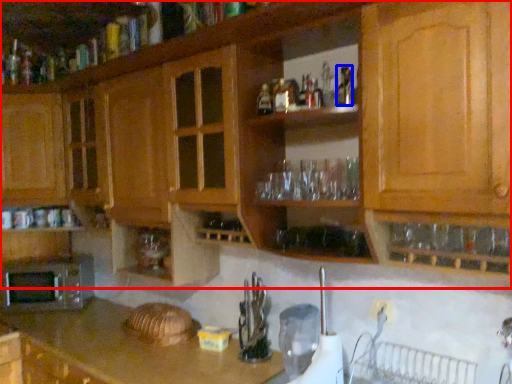
Question: Which of the following is the farthest to the observer, cabinetry (highlighted by a red box) or bottle (highlighted by a blue box)?

Choices:
 (A) cabinetry
 (B) bottle

Answer: (B)